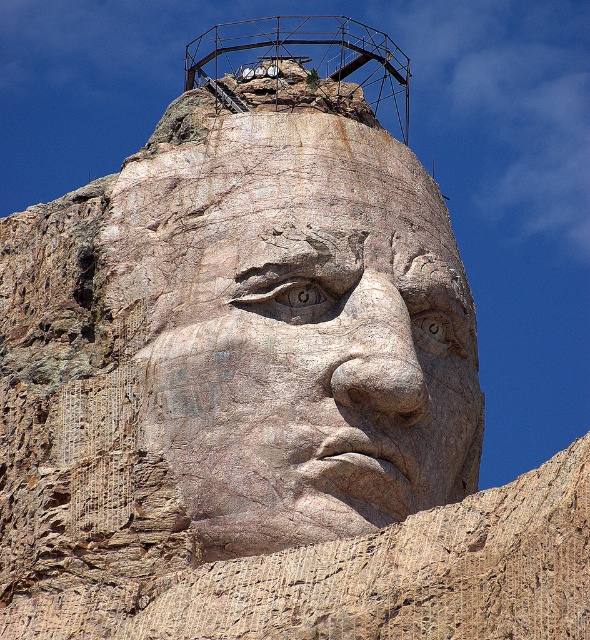
You are a tour guide explaining the monument to visitors. You want to emphasize the size comparison between the carved stone face at center and the rusty metal water tower at upper center. How would you describe their sizes in relation to each other?

The carved stone face at center has a smaller width than the rusty metal water tower at upper center, so the water tower appears wider from this viewpoint.

You are standing in front of the monumental rock carving of a human face and want to take a photo. You notice two points marked on the image at coordinates point (427, 396) and point (335, 99). Which point is positioned closer to your viewpoint?

Point (427, 396) is closer to the viewer than point (335, 99).